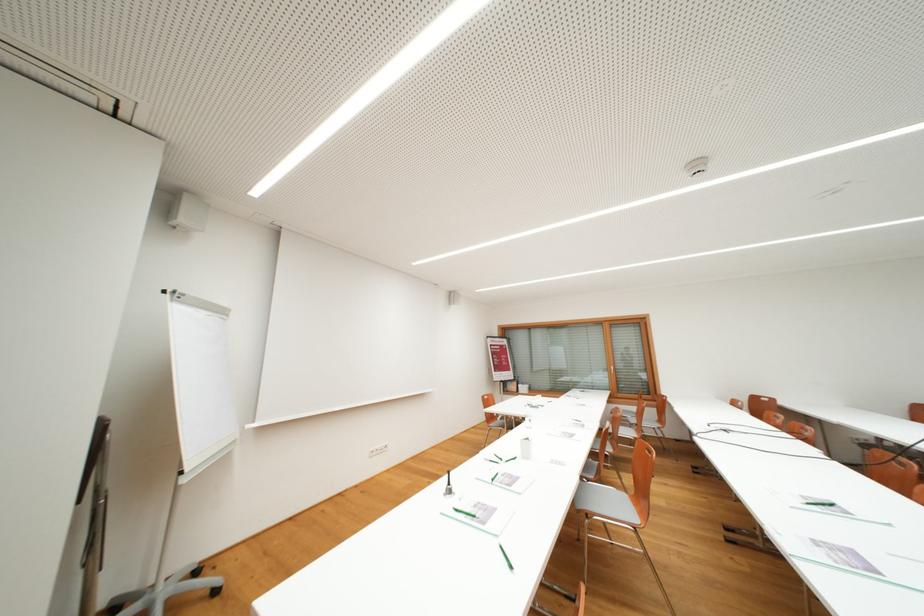
Identify the location of whiteboard clamp. Image resolution: width=924 pixels, height=616 pixels. (179, 297).